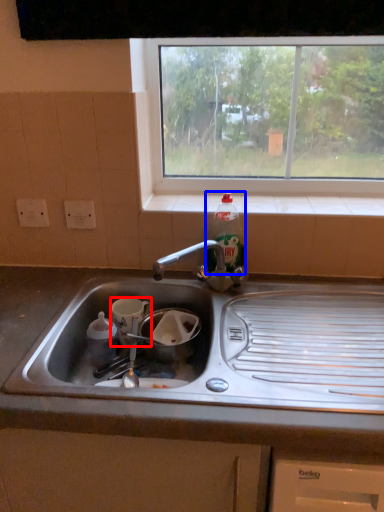
Question: Which object is further to the camera taking this photo, appliance (highlighted by a red box) or bottle (highlighted by a blue box)?

Choices:
 (A) appliance
 (B) bottle

Answer: (B)